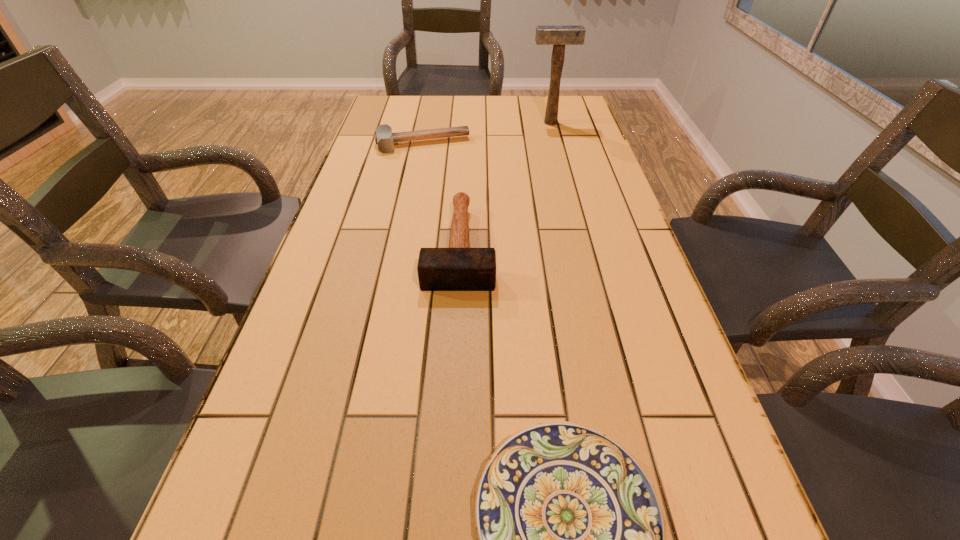
The width and height of the screenshot is (960, 540). What are the coordinates of `free space that is in between the nearest mallet and the tallest mallet` in the screenshot? It's located at (505, 184).

Locate an element on the screen. object that is the second closest to the second farthest mallet is located at coordinates (458, 268).

This screenshot has height=540, width=960. Identify the location of object that stands as the closest to the shortest object. (458, 268).

Locate which mallet is the closest to the third shortest object. Please provide its 2D coordinates. Your answer should be formatted as a tuple, i.e. [(x, y)], where the tuple contains the x and y coordinates of a point satisfying the conditions above.

[(384, 137)]

Identify the location of mallet identified as the closest to the nearest mallet. (384, 137).